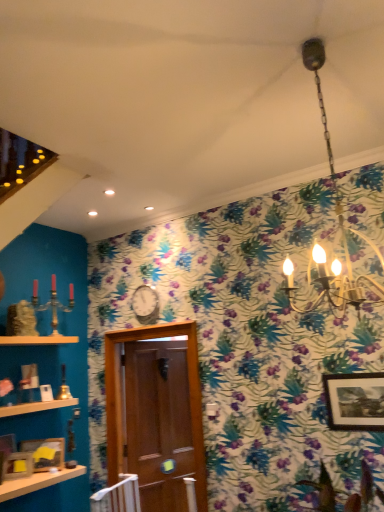
The width and height of the screenshot is (384, 512). In order to click on blank space situated above gold metallic chandelier at upper center (from a real-world perspective) in this screenshot , I will do `click(304, 47)`.